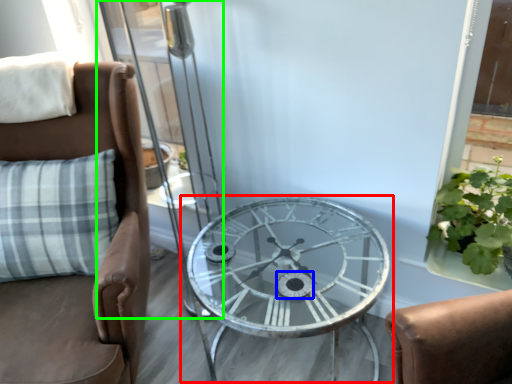
Question: Estimate the real-world distances between objects in this image. Which object is farther from table (highlighted by a red box), oval (highlighted by a blue box) or screen door (highlighted by a green box)?

Choices:
 (A) oval
 (B) screen door

Answer: (B)